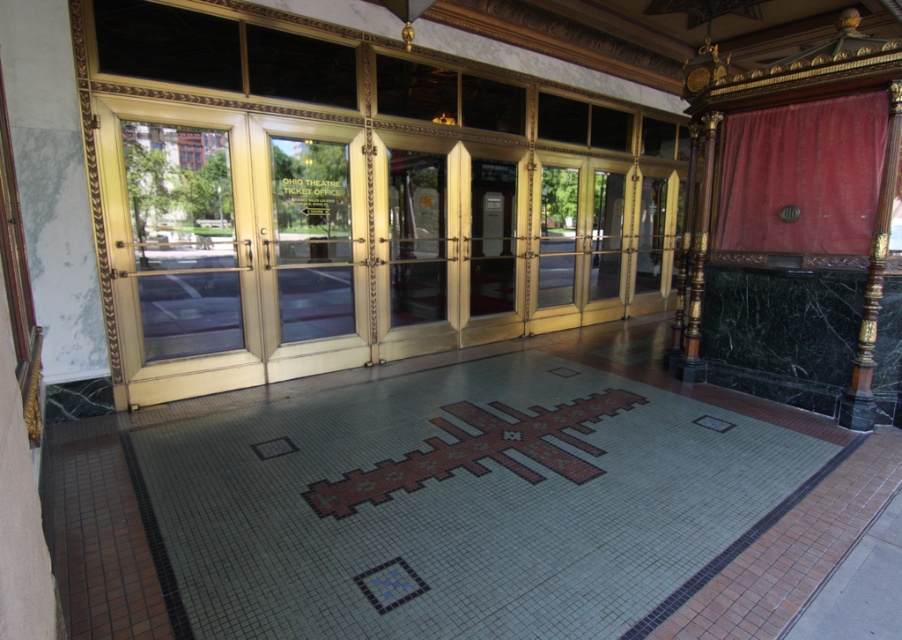
Looking at this image, you are standing at the entrance of the OHIO THEATRE TICKET OFFICE. You see a point marked at coordinates (x=347, y=196). What does this point indicate?

The point at coordinates (x=347, y=196) indicates the gold gilded doors at center.

You are standing at the entrance of the Ohio Theatre Ticket Office and notice two points marked on the mosaic floor. The first point is at coordinates point (100, 150) and the second is at point (864, 99). Which point is closer to you?

Point (100, 150) is closer to the camera than point (864, 99), so the first point is closer to you.